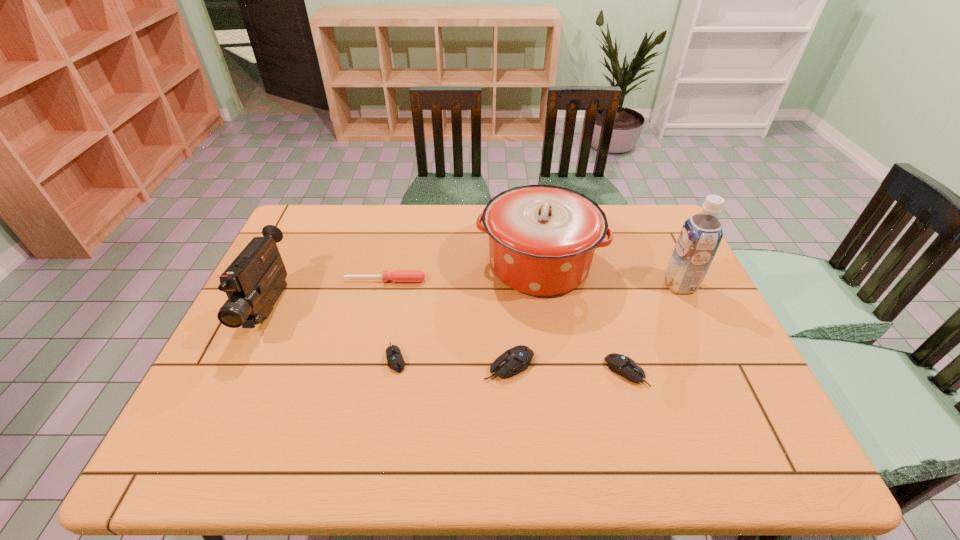
Identify the location of the leftmost computer mouse. (395, 360).

Identify the location of the shortest computer mouse. Image resolution: width=960 pixels, height=540 pixels. (395, 360).

What are the coordinates of `the tallest computer mouse` in the screenshot? It's located at (513, 361).

Locate an element on the screen. This screenshot has width=960, height=540. the rightmost computer mouse is located at coordinates (622, 365).

Find the location of `casserole`. casserole is located at coordinates (542, 238).

Image resolution: width=960 pixels, height=540 pixels. Find the location of `the rightmost object`. the rightmost object is located at coordinates (701, 234).

Identify the location of the tallest object. (701, 234).

Find the location of a particular element. This screenshot has height=540, width=960. the leftmost object is located at coordinates (253, 282).

You are a GUI agent. You are given a task and a screenshot of the screen. Output one action in this format:
    pyautogui.click(x=<x>, y=<y>)
    Task: Click on the screwdriver
    
    Given the screenshot: What is the action you would take?
    pyautogui.click(x=396, y=275)

Locate an element on the screen. free point located 0.210m on the right of the shortest computer mouse is located at coordinates (490, 358).